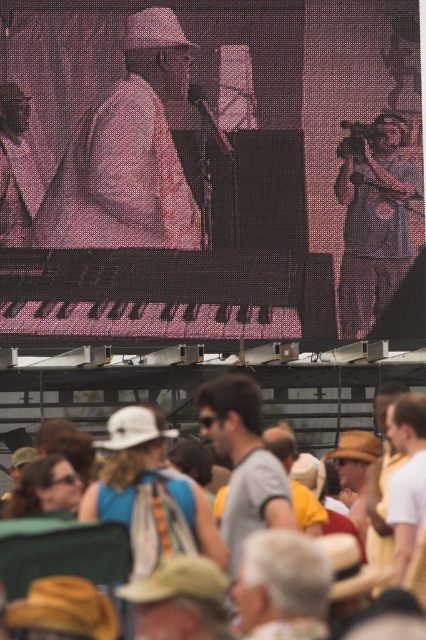
Who is more distant from viewer, (x=405, y=164) or (x=229, y=532)?

Positioned behind is point (x=405, y=164).

Where is `matte purple camera at upper right`? The image size is (426, 640). matte purple camera at upper right is located at coordinates (374, 218).

Locate an element on the screen. The image size is (426, 640). white woven hat at center is located at coordinates (252, 497).

How much distance is there between matte white hat at center and gray matte shirt at center?

matte white hat at center is 31.74 meters from gray matte shirt at center.

Can you confirm if matte white hat at center is bigger than gray matte shirt at center?

Incorrect, matte white hat at center is not larger than gray matte shirt at center.

Where is `matte white hat at center`? This screenshot has width=426, height=640. matte white hat at center is located at coordinates (127, 154).

At what (x,y) coordinates should I click in order to perform the action: click on matte white hat at center. Please return your answer as a coordinate pair (x, y). This screenshot has width=426, height=640. Looking at the image, I should click on (127, 154).